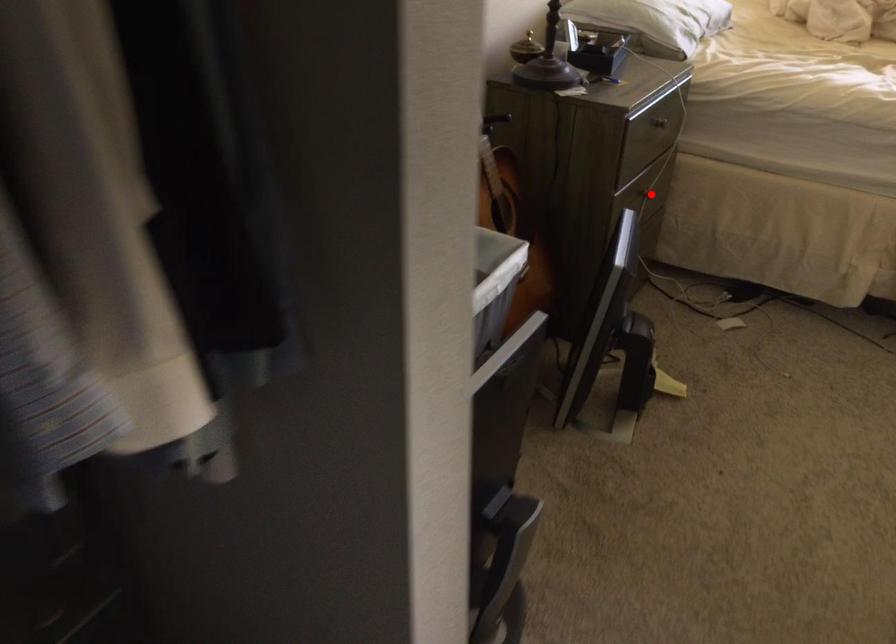
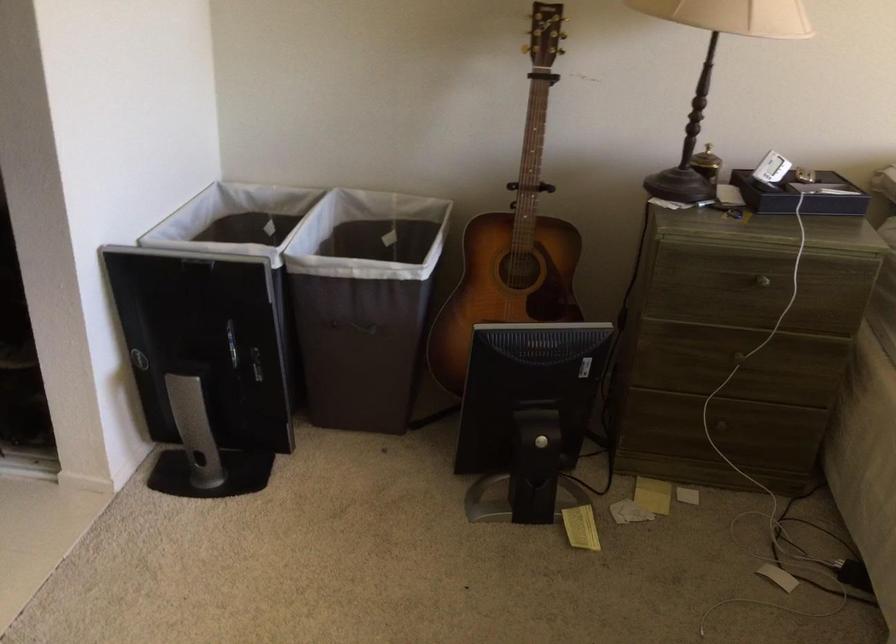
The point at the highlighted location is marked in the first image. Where is the corresponding point in the second image?

(738, 357)